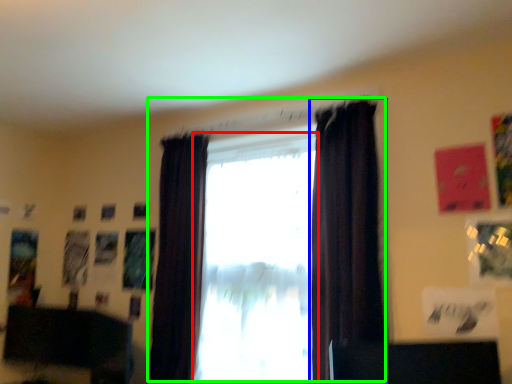
Question: Estimate the real-world distances between objects in this image. Which object is farther from window (highlighted by a red box), curtain (highlighted by a blue box) or window (highlighted by a green box)?

Choices:
 (A) curtain
 (B) window

Answer: (A)